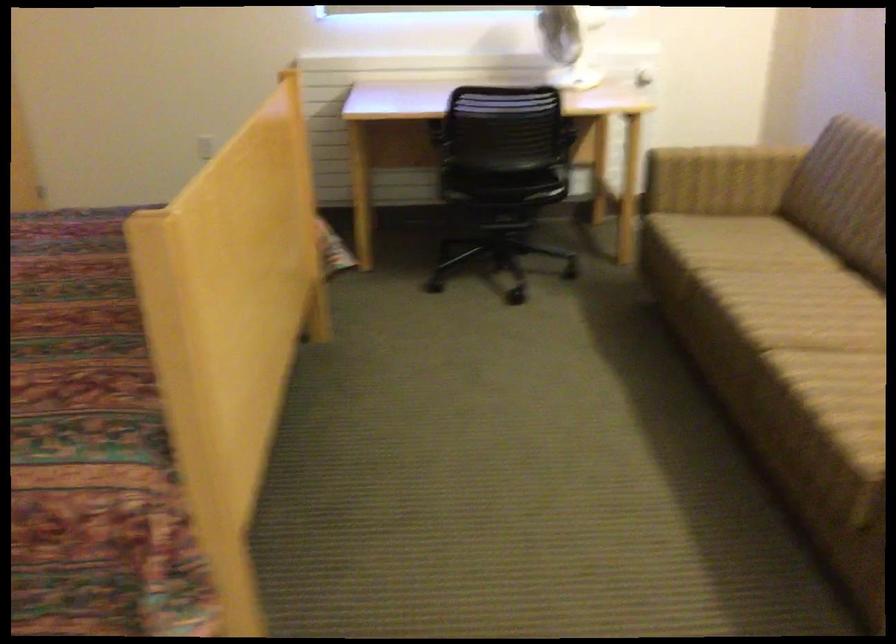
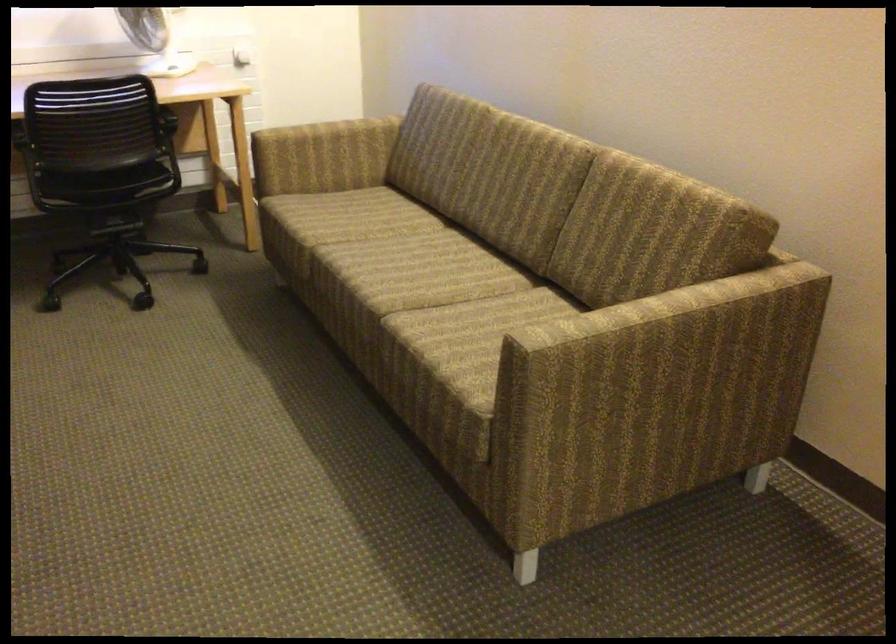
Locate, in the second image, the point that corresponds to [784,328] in the first image.

(395, 289)